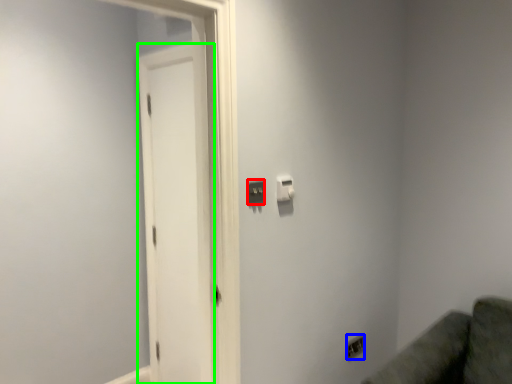
Question: Which object is positioned closest to light switch (highlighted by a red box)? Select from electric outlet (highlighted by a blue box) and screen door (highlighted by a green box).

Choices:
 (A) electric outlet
 (B) screen door

Answer: (B)